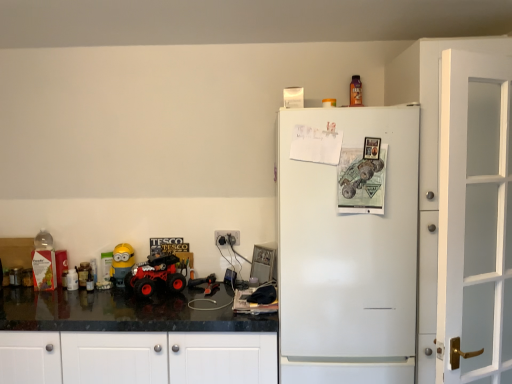
Question: Is yellow matte minion at left, which appears as the first toy when ordered from the bottom, not inside metallic orange bottle at upper center, placed as the 3th toy when sorted from left to right?

Choices:
 (A) no
 (B) yes

Answer: (B)

Question: From a real-world perspective, is yellow matte minion at left, arranged as the 2th toy when viewed from the right, physically above metallic orange bottle at upper center, placed as the first toy when sorted from top to bottom?

Choices:
 (A) yes
 (B) no

Answer: (B)

Question: Is yellow matte minion at left, which is the 3th toy in top-to-bottom order, oriented away from metallic orange bottle at upper center, placed as the 3th toy when sorted from left to right?

Choices:
 (A) yes
 (B) no

Answer: (B)

Question: Is yellow matte minion at left, which appears as the first toy when ordered from the bottom, in front of metallic orange bottle at upper center, placed as the first toy when sorted from top to bottom?

Choices:
 (A) no
 (B) yes

Answer: (A)

Question: Does yellow matte minion at left, which appears as the second toy when viewed from the left, lie behind metallic orange bottle at upper center, acting as the 1th toy starting from the right?

Choices:
 (A) no
 (B) yes

Answer: (B)

Question: From a real-world perspective, is yellow matte minion at left, which appears as the second toy when viewed from the left, above or below metallic orange bottle at upper center, acting as the 1th toy starting from the right?

Choices:
 (A) below
 (B) above

Answer: (A)

Question: Is yellow matte minion at left, which appears as the first toy when ordered from the bottom, wider or thinner than metallic orange bottle at upper center, which is the 3th toy in bottom-to-top order?

Choices:
 (A) wide
 (B) thin

Answer: (A)

Question: Is yellow matte minion at left, which appears as the first toy when ordered from the bottom, taller or shorter than metallic orange bottle at upper center, placed as the 3th toy when sorted from left to right?

Choices:
 (A) tall
 (B) short

Answer: (A)

Question: From the image's perspective, relative to metallic orange bottle at upper center, placed as the first toy when sorted from top to bottom, is yellow matte minion at left, arranged as the 2th toy when viewed from the right, above or below?

Choices:
 (A) below
 (B) above

Answer: (A)

Question: From a real-world perspective, relative to white matte refrigerator at right, is yellow matte minion at left, which appears as the first toy when ordered from the bottom, vertically above or below?

Choices:
 (A) above
 (B) below

Answer: (B)

Question: Considering their positions, is yellow matte minion at left, which appears as the second toy when viewed from the left, located in front of or behind white matte refrigerator at right?

Choices:
 (A) behind
 (B) front

Answer: (A)

Question: From their relative heights in the image, would you say yellow matte minion at left, which appears as the first toy when ordered from the bottom, is taller or shorter than white matte refrigerator at right?

Choices:
 (A) short
 (B) tall

Answer: (A)

Question: Looking at their shapes, would you say yellow matte minion at left, which appears as the first toy when ordered from the bottom, is wider or thinner than white matte refrigerator at right?

Choices:
 (A) wide
 (B) thin

Answer: (B)

Question: Considering the positions of rubberized red monster truck at lower left and white glass door at right in the image, is rubberized red monster truck at lower left bigger or smaller than white glass door at right?

Choices:
 (A) big
 (B) small

Answer: (B)

Question: From the image's perspective, relative to white glass door at right, is rubberized red monster truck at lower left above or below?

Choices:
 (A) above
 (B) below

Answer: (B)